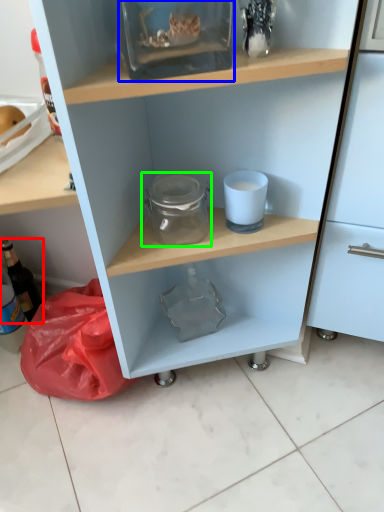
Question: Estimate the real-world distances between objects in this image. Which object is farther from bottle (highlighted by a red box), glass box (highlighted by a blue box) or glass jar (highlighted by a green box)?

Choices:
 (A) glass box
 (B) glass jar

Answer: (A)